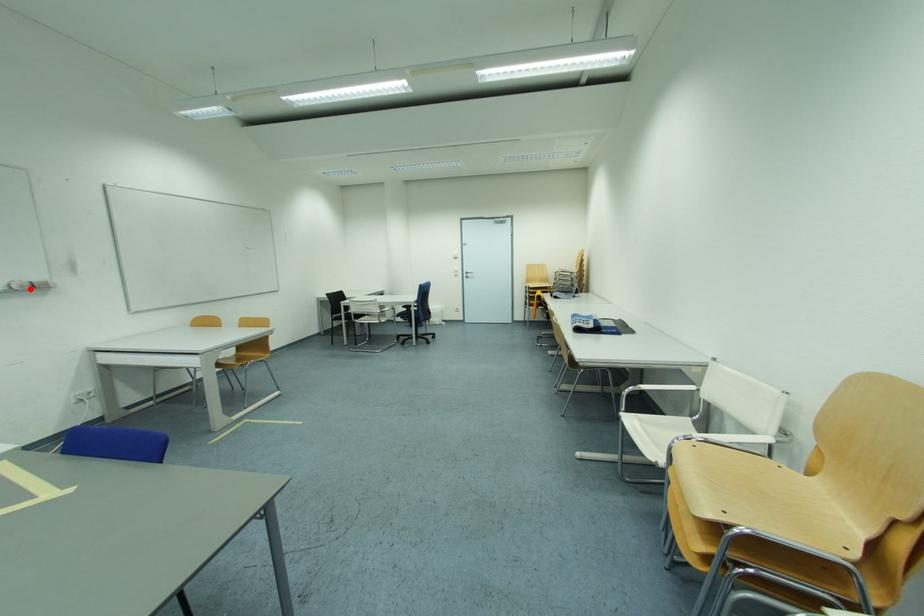
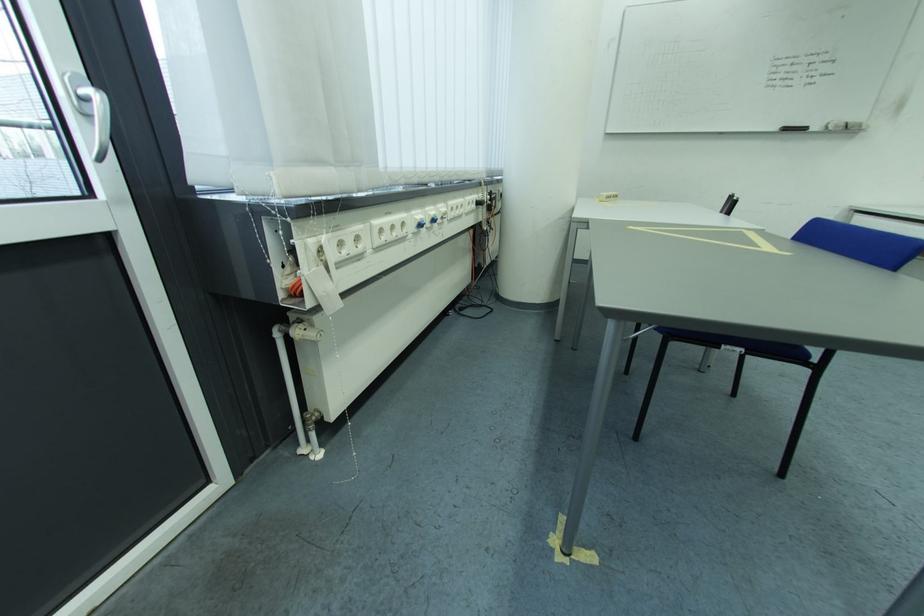
Find the pixel in the second image that matches the highlighted location in the first image.

(845, 129)